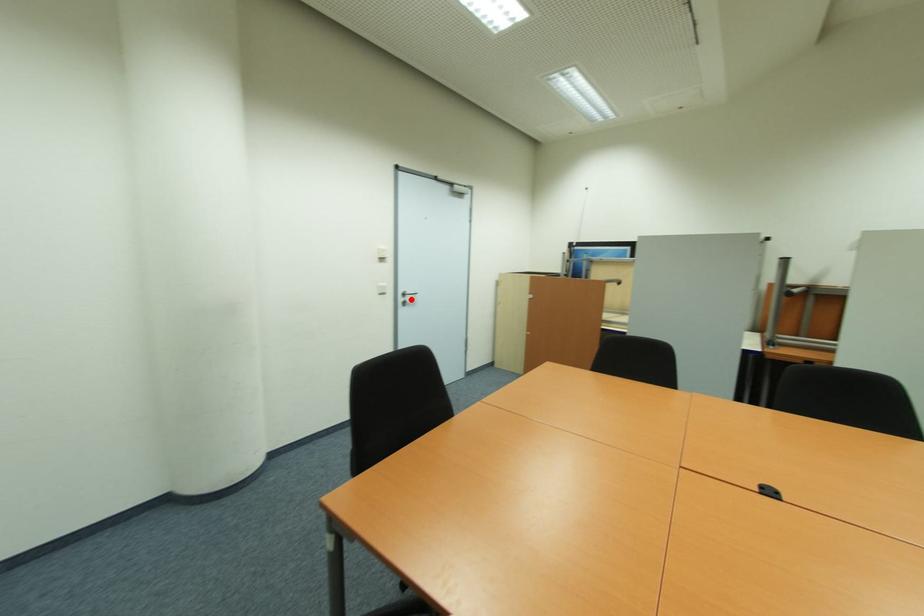
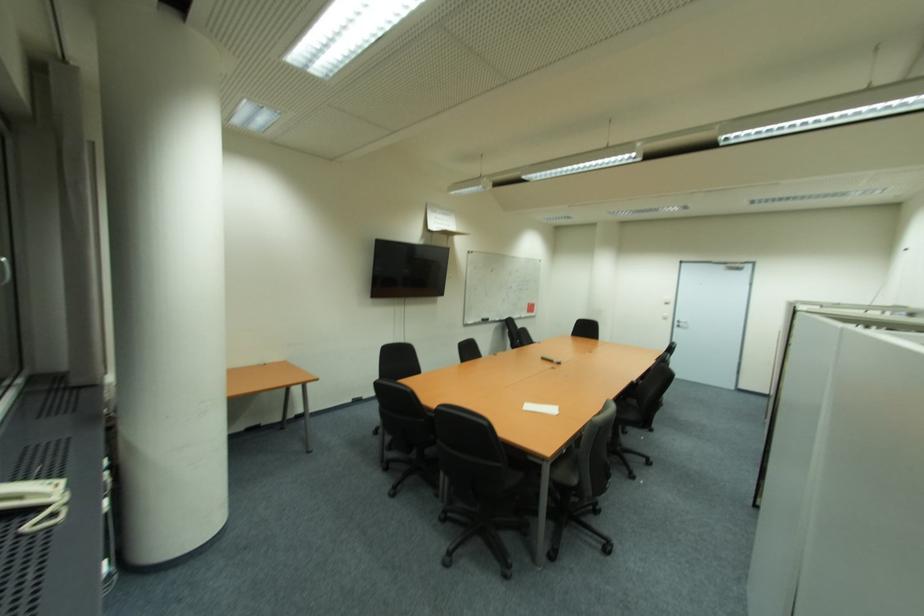
Question: I am providing you with two images of the same scene from different viewpoints. Given a red point in image1, look at the same physical point in image2. Is it:

Choices:
 (A) Closer to the viewpoint
 (B) Farther from the viewpoint

Answer: (B)